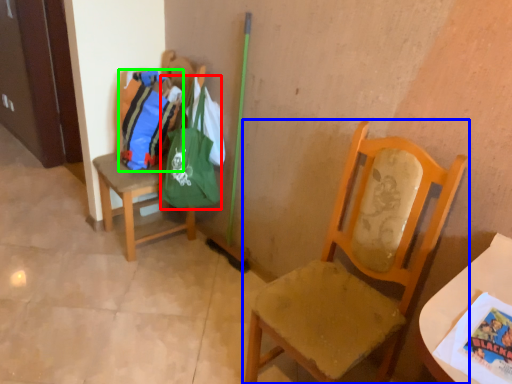
Question: Which object is positioned closest to bag (highlighted by a red box)? Select from chair (highlighted by a blue box) and bag (highlighted by a green box).

Choices:
 (A) chair
 (B) bag

Answer: (B)